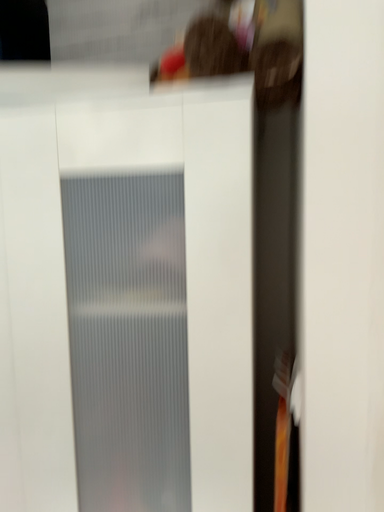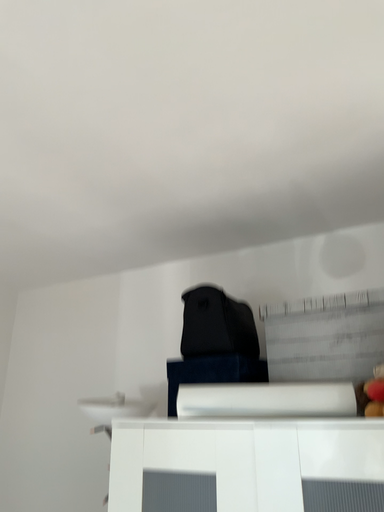
Question: Which way did the camera rotate in the video?

Choices:
 (A) rotated upward
 (B) rotated downward

Answer: (A)